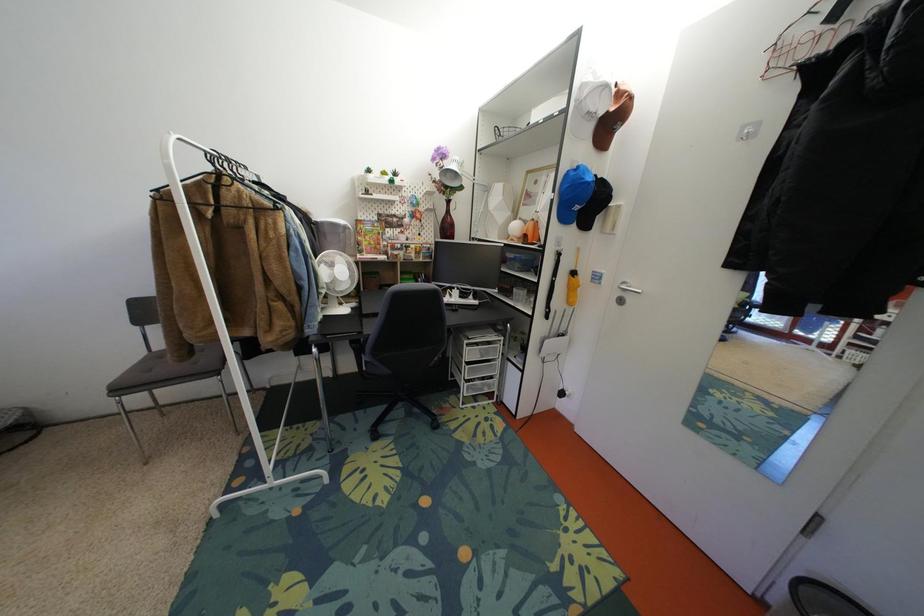
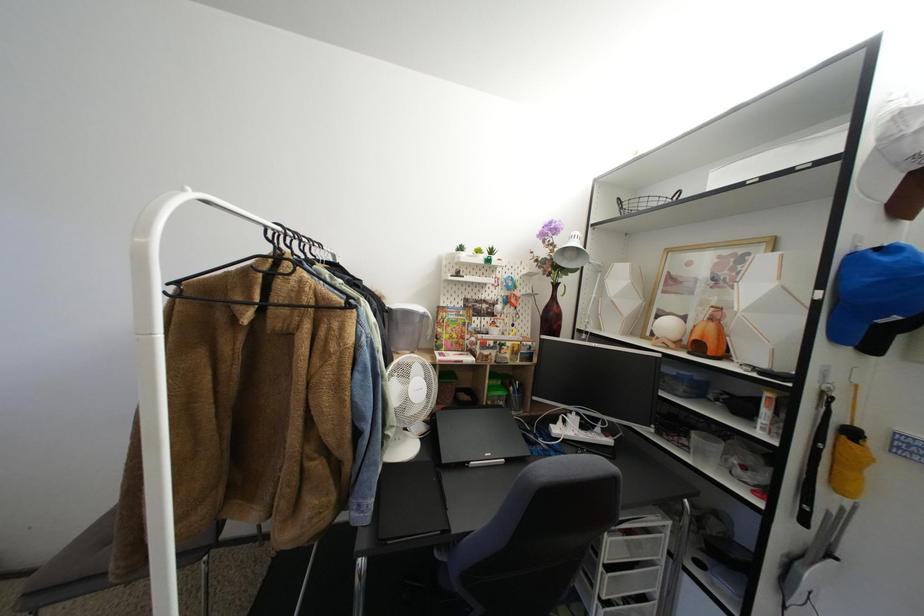
Question: The first image is from the beginning of the video and the second image is from the end. How did the camera likely rotate when shooting the video?

Choices:
 (A) Left
 (B) Right
 (C) Up
 (D) Down

Answer: (C)